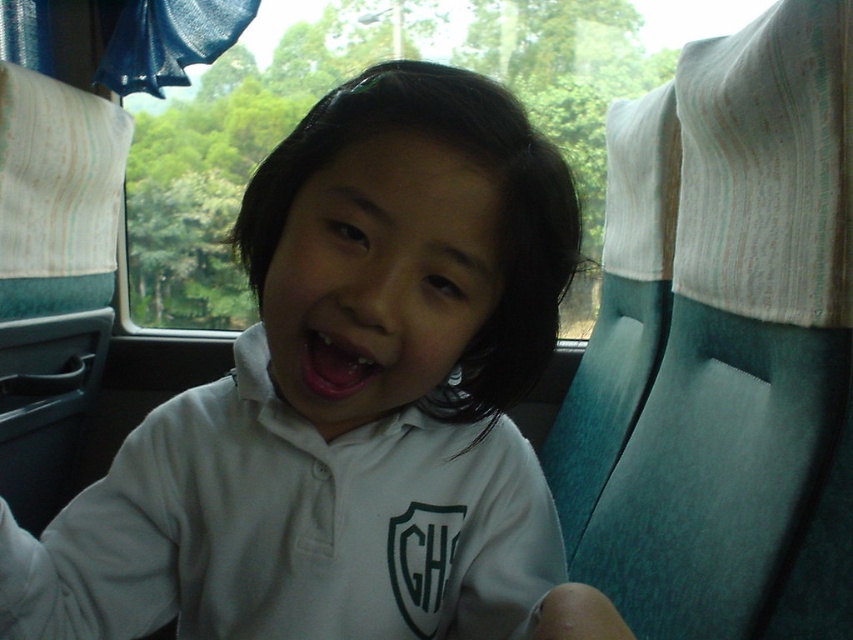
Can you confirm if white matte shirt at center is shorter than pink glossy lips at center?

Incorrect, white matte shirt at center's height does not fall short of pink glossy lips at center's.

Does point (474, 189) come in front of point (360, 355)?

Yes, point (474, 189) is closer to viewer.

Does point (520, 198) come behind point (335, 388)?

That is False.

The width and height of the screenshot is (853, 640). I want to click on white matte shirt at center, so click(x=350, y=404).